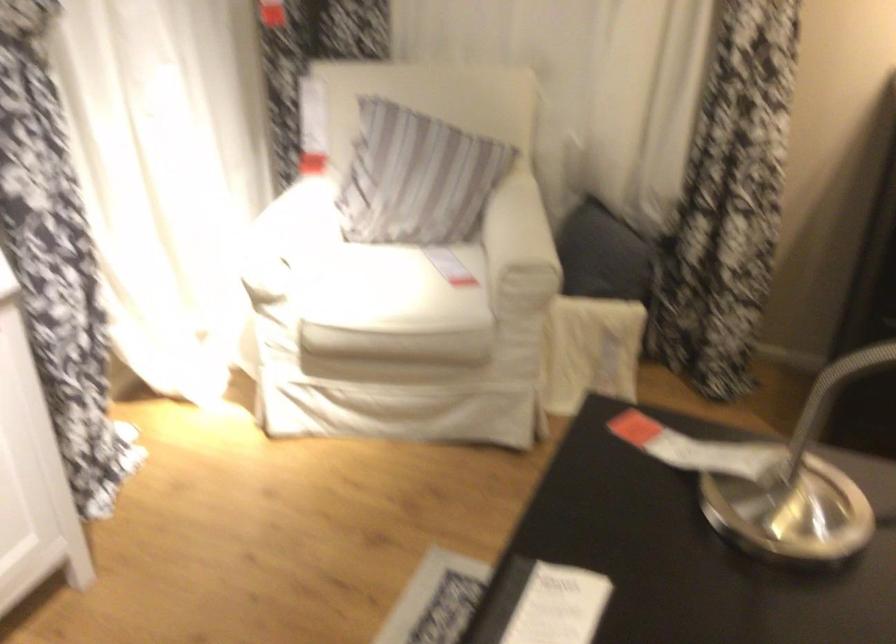
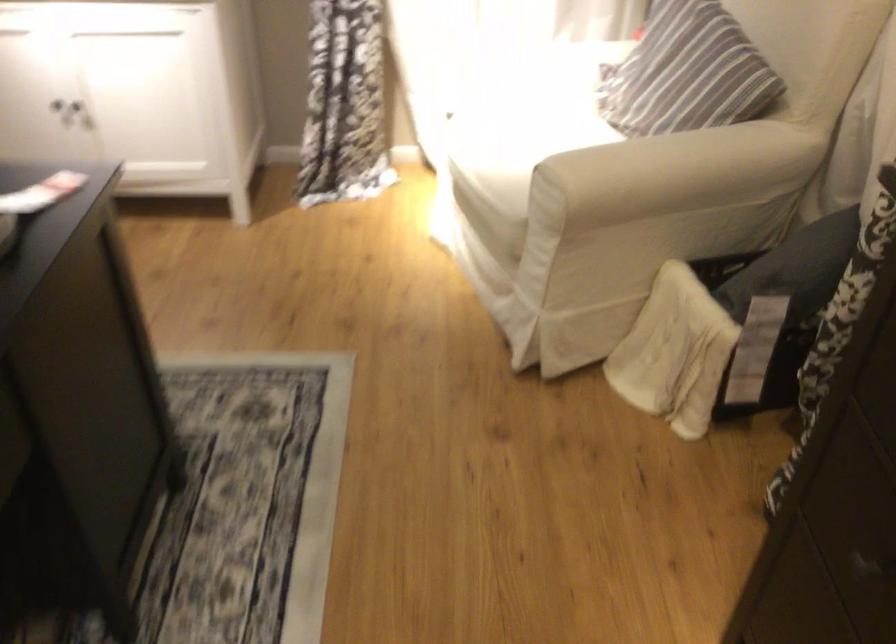
Locate, in the second image, the point that corresponds to point (452, 169) in the first image.

(687, 73)